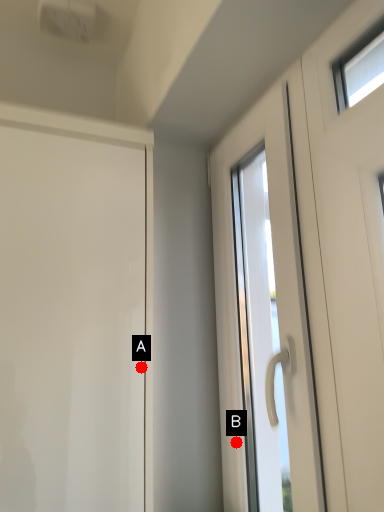
Question: Two points are circled on the image, labeled by A and B beside each circle. Which point appears farthest from the camera in this image?

Choices:
 (A) A is further
 (B) B is further

Answer: (B)